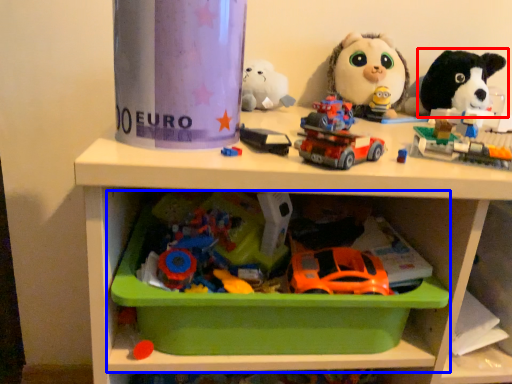
Question: Which of the following is the farthest to the observer, toy (highlighted by a red box) or shelf (highlighted by a blue box)?

Choices:
 (A) toy
 (B) shelf

Answer: (A)